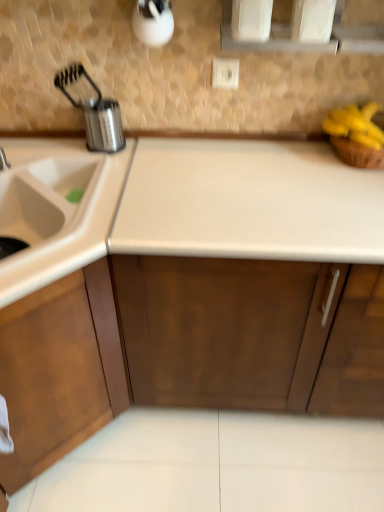
I want to click on free location above white laminate countertop at center (from a real-world perspective), so click(274, 179).